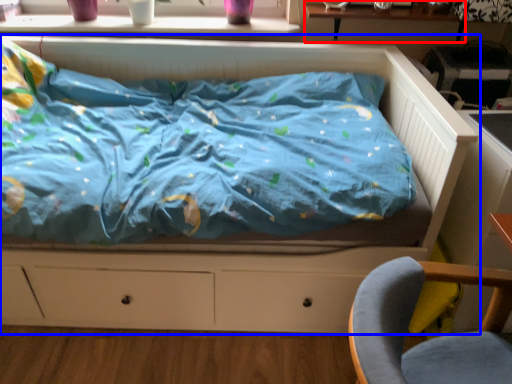
Question: Which object is further to the camera taking this photo, table (highlighted by a red box) or bed (highlighted by a blue box)?

Choices:
 (A) table
 (B) bed

Answer: (A)